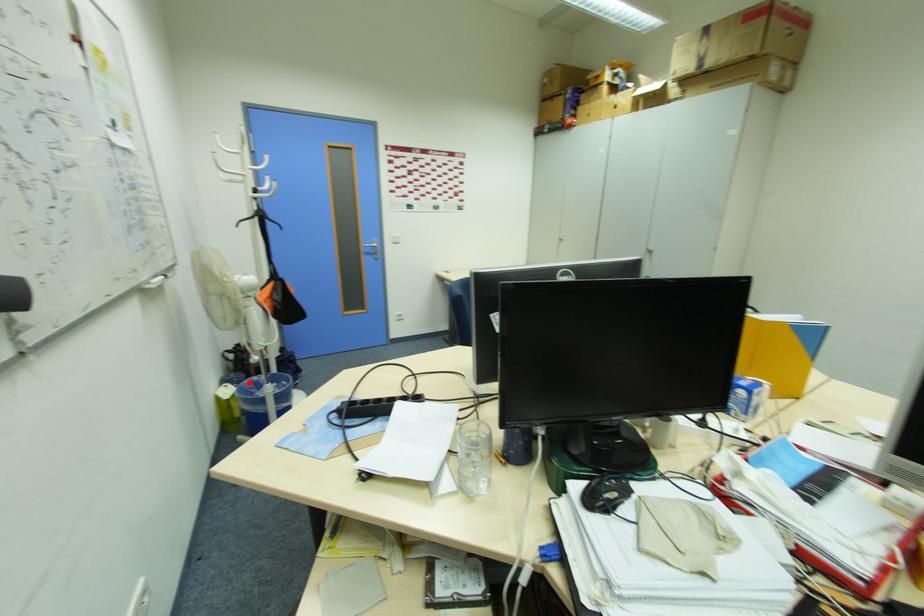
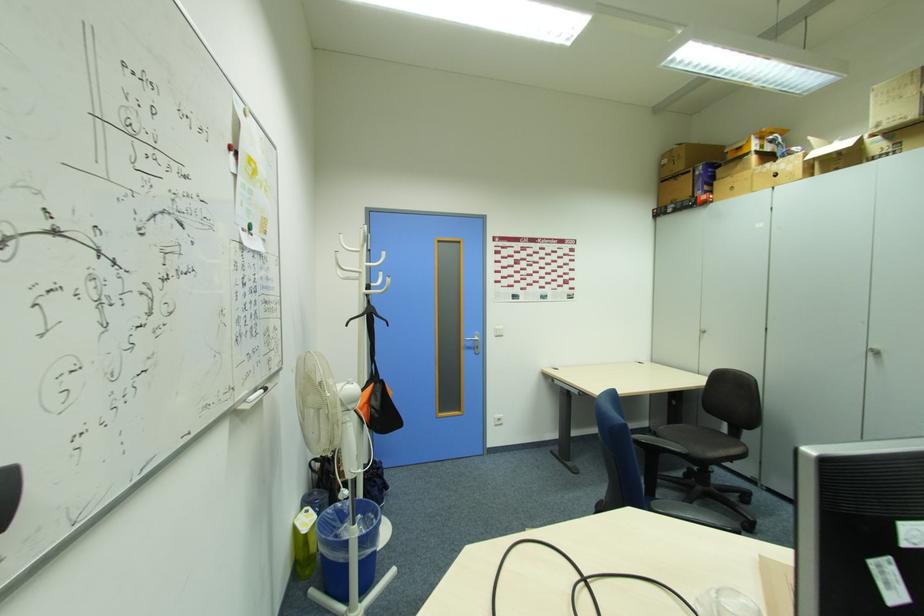
Question: I am providing you with two images of the same scene from different viewpoints. Given a red point in image1, look at the same physical point in image2. Is it:

Choices:
 (A) Closer to the viewpoint
 (B) Farther from the viewpoint

Answer: (B)